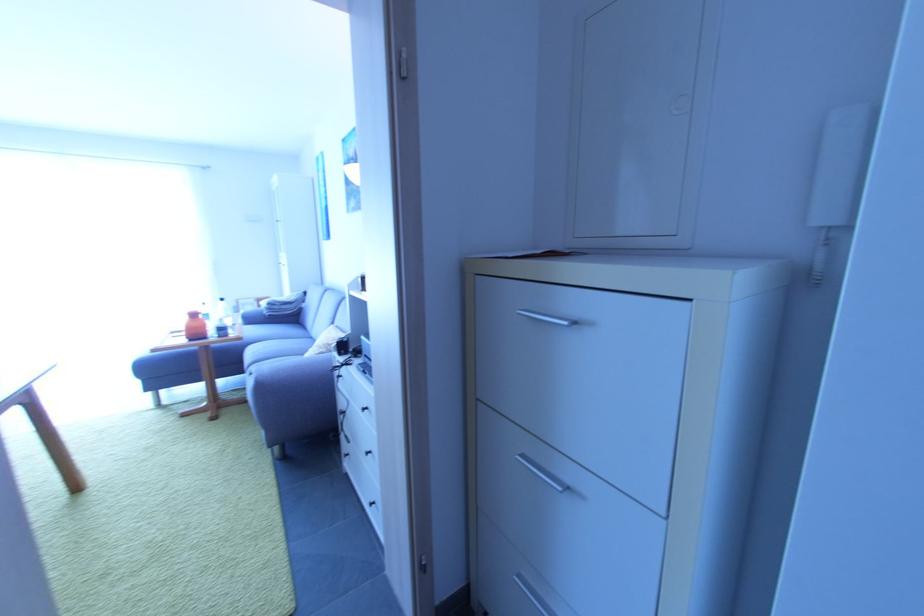
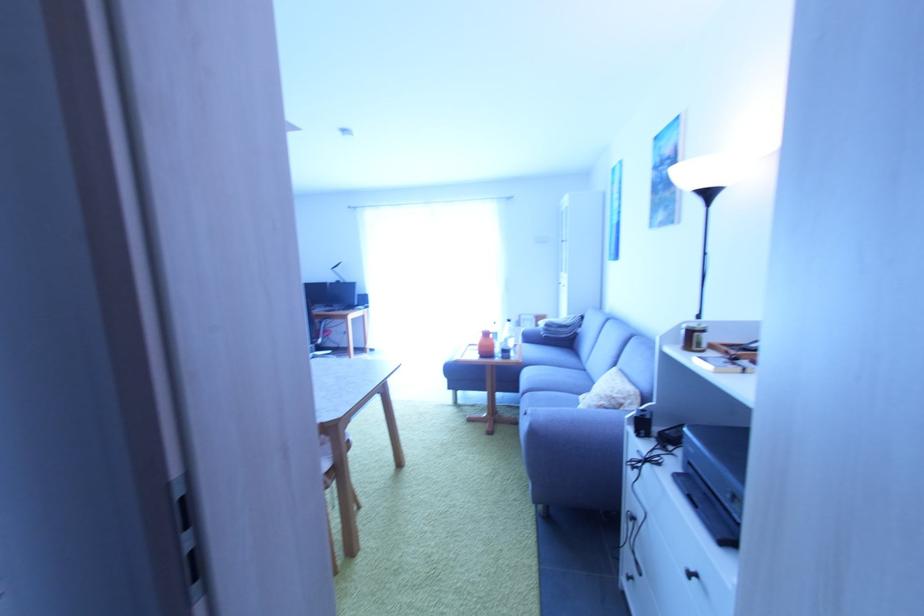
Question: The camera is either moving clockwise (left) or counter-clockwise (right) around the object. The first image is from the beginning of the video and the second image is from the end. Is the camera moving left or right when shooting the video?

Choices:
 (A) Left
 (B) Right

Answer: (B)